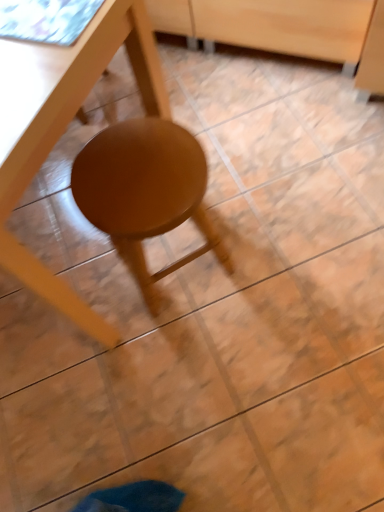
Locate an element on the screen. The height and width of the screenshot is (512, 384). free area below matte wood stool at center (from a real-world perspective) is located at coordinates point(187,286).